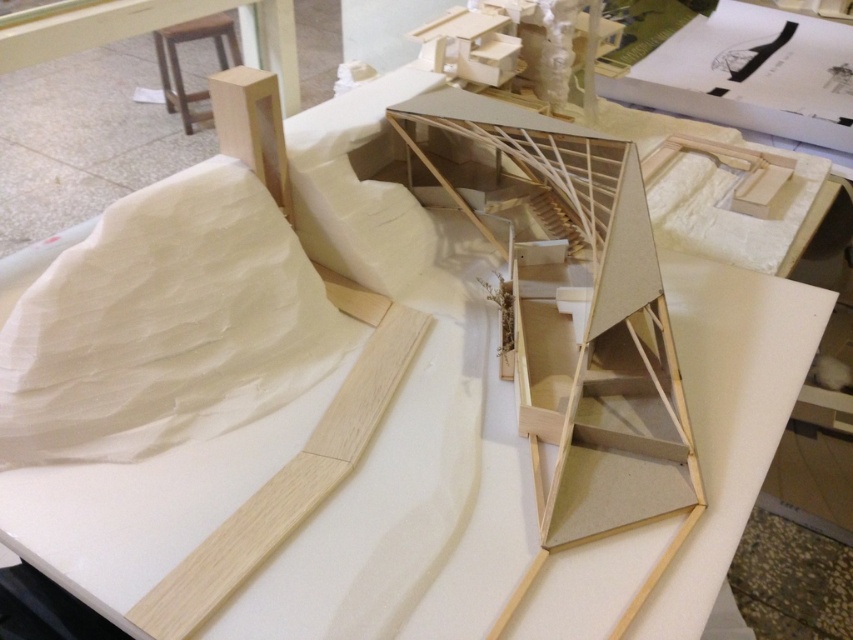
Who is lower down, white paper at upper left or natural wood plank at lower left?

Positioned lower is natural wood plank at lower left.

Is point (67, 417) more distant than point (334, 465)?

No, it is in front of (334, 465).

Locate an element on the screen. This screenshot has width=853, height=640. white paper at upper left is located at coordinates (165, 324).